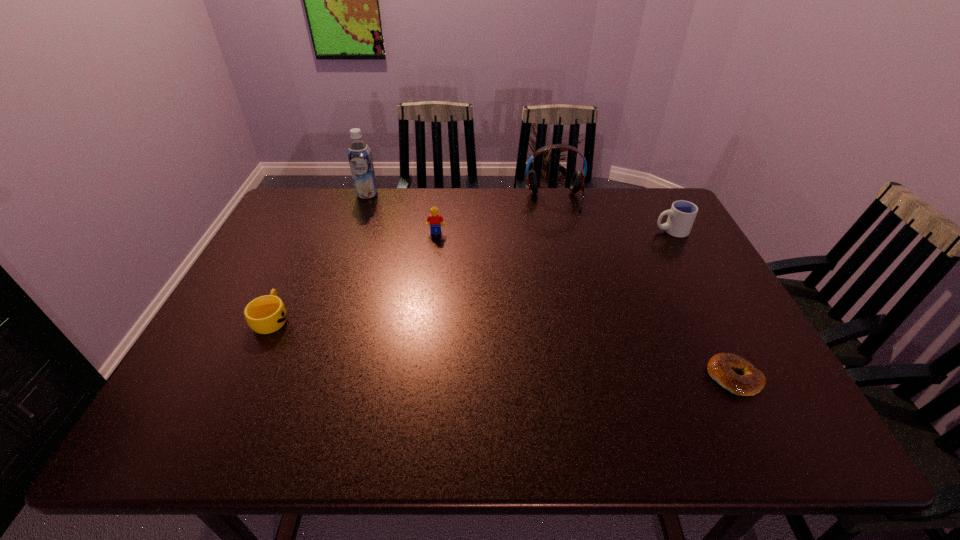
The width and height of the screenshot is (960, 540). Identify the location of headset located in the far edge section of the desktop. (577, 182).

What are the coordinates of `cup that is at the far edge` in the screenshot? It's located at (682, 214).

Where is `object positioned at the left edge`? This screenshot has height=540, width=960. object positioned at the left edge is located at coordinates (266, 314).

Where is `cup that is at the right edge`? The width and height of the screenshot is (960, 540). cup that is at the right edge is located at coordinates 682,214.

The image size is (960, 540). I want to click on bagel located in the right edge section of the desktop, so click(721, 367).

Identify the location of object present at the far right corner. (682, 214).

In the image, there is a desktop. At what (x,y) coordinates should I click in order to perform the action: click on vacant space at the far edge. Please return your answer as a coordinate pair (x, y). Image resolution: width=960 pixels, height=540 pixels. Looking at the image, I should click on (584, 221).

Image resolution: width=960 pixels, height=540 pixels. What are the coordinates of `blank area at the near edge` in the screenshot? It's located at (458, 419).

This screenshot has height=540, width=960. I want to click on vacant position at the right edge of the desktop, so click(721, 318).

This screenshot has width=960, height=540. In the image, there is a desktop. In order to click on vacant space at the far right corner in this screenshot , I will do `click(638, 199)`.